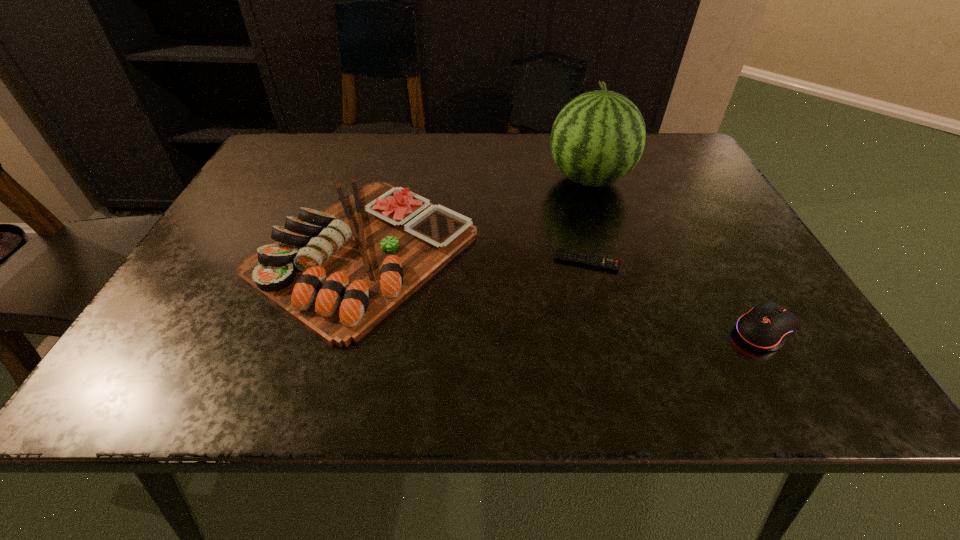
What are the coordinates of `the tallest object` in the screenshot? It's located at (598, 137).

What are the coordinates of `the leftmost object` in the screenshot? It's located at (339, 272).

In order to click on platter in this screenshot , I will do `click(339, 272)`.

Identify the location of computer mouse. (768, 325).

You are a GUI agent. You are given a task and a screenshot of the screen. Output one action in this format:
    pyautogui.click(x=<x>, y=<y>)
    Task: Click on the rightmost object
    The image size is (960, 540).
    Given the screenshot: What is the action you would take?
    pyautogui.click(x=768, y=325)

Locate an element on the screen. The width and height of the screenshot is (960, 540). the shortest object is located at coordinates [604, 263].

Where is `free space located on the front of the watermelon`? free space located on the front of the watermelon is located at coordinates (606, 232).

Where is `vacant space located on the right of the third shortest object`? vacant space located on the right of the third shortest object is located at coordinates pos(572,252).

This screenshot has width=960, height=540. Identify the location of free space located 0.400m on the back of the computer mouse. (682, 186).

Identify the location of vacant area located 0.290m on the left of the shortest object. (413, 261).